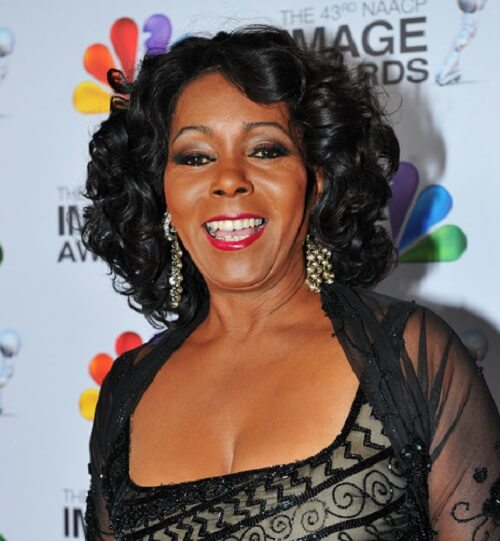
Find the location of `chest`. chest is located at coordinates (194, 435).